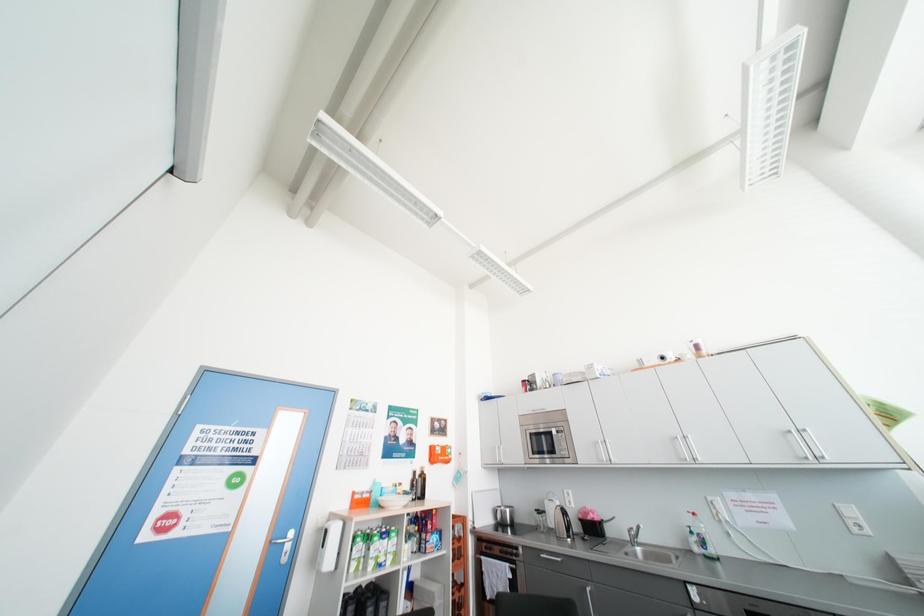
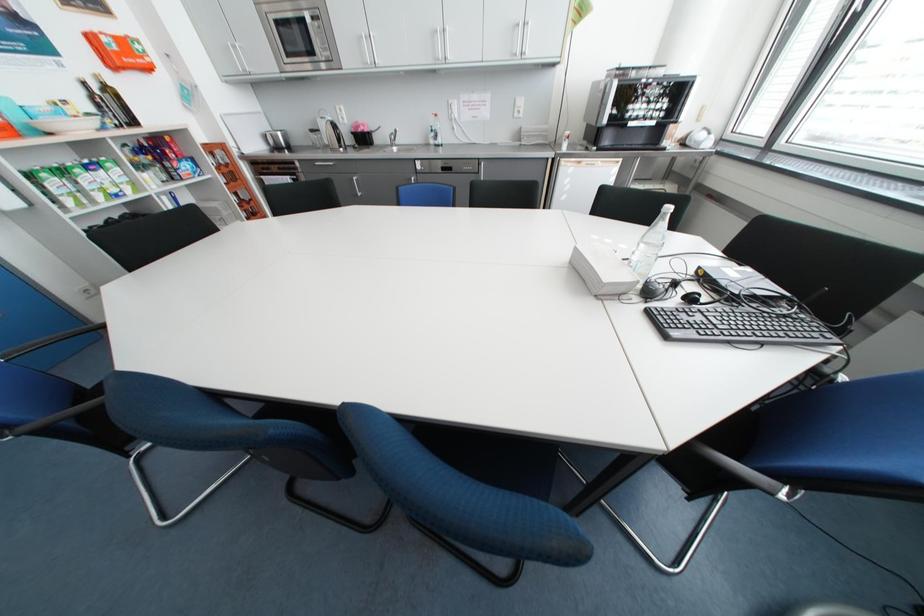
The images are taken continuously from a first-person perspective. In which direction is your viewpoint rotating?

The rotation direction of the camera is right-down.